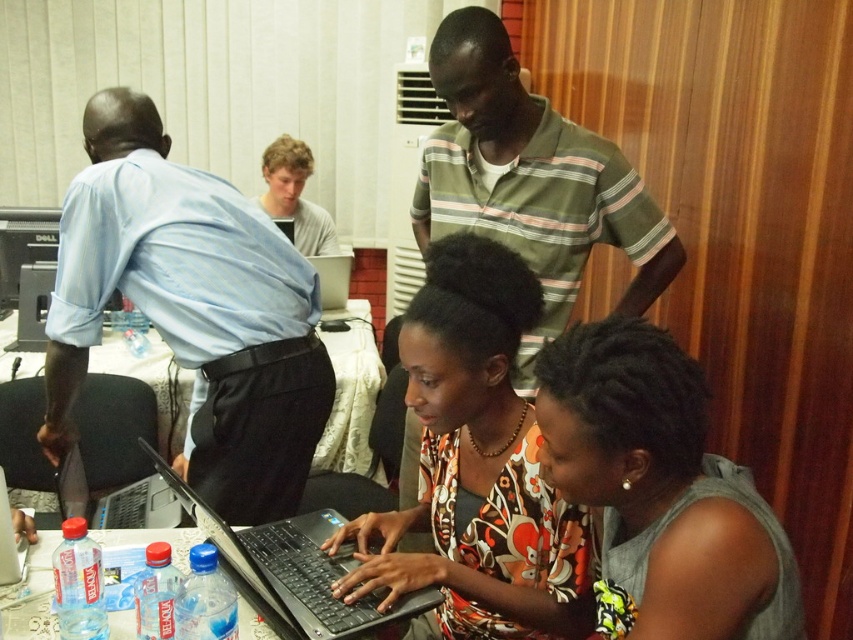
Question: Where is clear plastic bottles at lower left located in relation to silver metallic laptop at lower left in the image?

Choices:
 (A) below
 (B) above

Answer: (B)

Question: Which object is farther from the camera taking this photo?

Choices:
 (A) floral print blouse at center
 (B) silver metallic laptop at center
 (C) silver metallic laptop at lower left
 (D) black plastic laptop at lower center

Answer: (B)

Question: Is clear plastic bottles at lower left thinner than light brown hair at upper center?

Choices:
 (A) yes
 (B) no

Answer: (B)

Question: Which is nearer to the silver metallic laptop at lower left?

Choices:
 (A) white glossy table at center
 (B) green striped shirt at upper center
 (C) black plastic laptop at lower center

Answer: (A)

Question: Among these objects, which one is farthest from the camera?

Choices:
 (A) light blue shirt at left
 (B) black glossy laptop at lower left
 (C) floral print blouse at center

Answer: (A)

Question: Is black plastic laptop at lower center closer to camera compared to black glossy laptop at lower left?

Choices:
 (A) no
 (B) yes

Answer: (B)